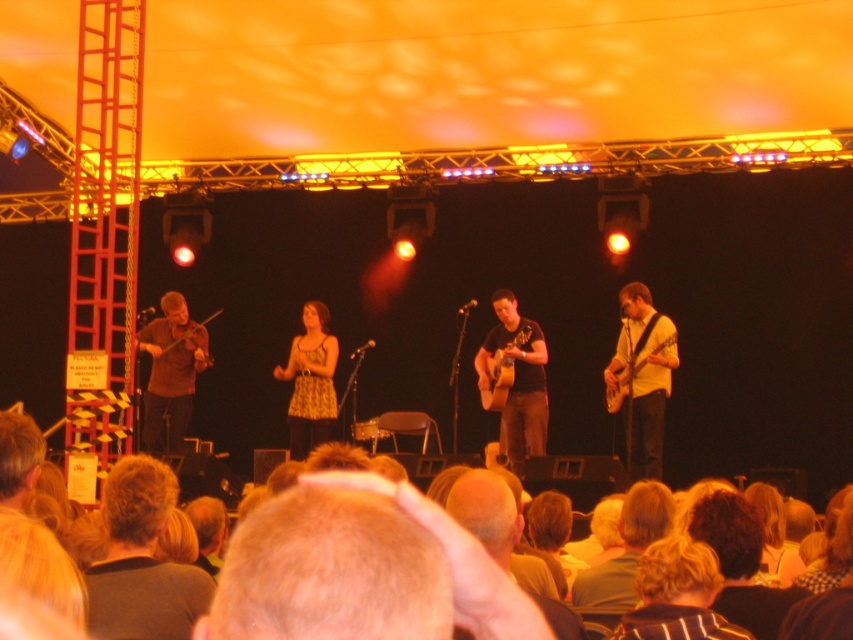
You are a photographer at the back of the venue and want to capture a clear shot of both the yellow printed dress at center and the wooden violin at left. Considering their sizes, which one will appear bigger in your photo?

The yellow printed dress at center will appear bigger in the photo since it has a larger size compared to the wooden violin at left.

You are a photographer standing at the back of the stage. You want to take a photo that includes both the yellow printed dress at center and the wooden violin at left. Given that your camera has a maximum focus range of 14 feet, will you be able to capture both subjects in focus?

The yellow printed dress at center and wooden violin at left are 14.02 feet apart. Since the camera can only focus up to 14 feet, the distance between them exceeds the focus range. Therefore, you won the be able to capture both in focus.